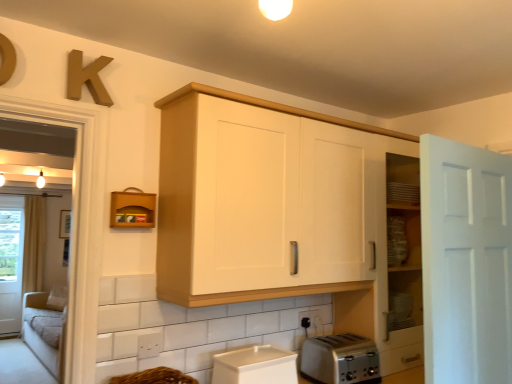
Question: Is white plastic container at lower center to the left or to the right of wooden letter k at upper left in the image?

Choices:
 (A) right
 (B) left

Answer: (A)

Question: Looking at their shapes, would you say white plastic container at lower center is wider or thinner than wooden letter k at upper left?

Choices:
 (A) thin
 (B) wide

Answer: (B)

Question: Based on their relative distances, which object is farther from the white plastic container at lower center?

Choices:
 (A) satin silver toaster at lower center
 (B) white matte door at right
 (C) black plastic electric outlet at lower center
 (D) brown leather shelf at upper left
 (E) beige fabric screen door at left

Answer: (E)

Question: Estimate the real-world distances between objects in this image. Which object is closer to the black plastic electric outlet at lower center?

Choices:
 (A) brown woven basket at lower center
 (B) satin silver toaster at lower center
 (C) white wood cabinet at upper center
 (D) beige fabric screen door at left
 (E) white plastic container at lower center

Answer: (B)